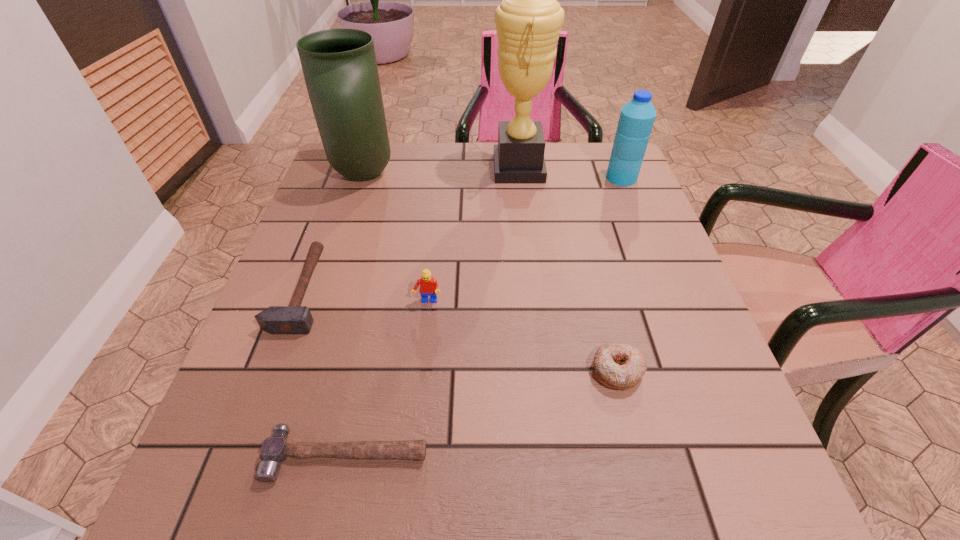
I want to click on the shortest object, so click(275, 449).

In order to click on free space located at the front of the tallest object with handles in this screenshot , I will do `click(412, 168)`.

What are the coordinates of `vacant space situated 0.160m at the front of the tallest object with handles` in the screenshot? It's located at (433, 168).

Where is `vacant space located at the front of the tallest object with handles`? The image size is (960, 540). vacant space located at the front of the tallest object with handles is located at coordinates [x=375, y=168].

In order to click on blank space located 0.400m on the right of the second tallest object in this screenshot , I will do `click(541, 174)`.

Identify the location of vacant space located on the front of the fifth shortest object. (660, 276).

Locate an element on the screen. vacant space located 0.300m on the front-facing side of the fourth shortest object is located at coordinates (410, 460).

Identify the location of vacant region located 0.160m on the striking surface of the taller hammer. The width and height of the screenshot is (960, 540). (403, 291).

You are a GUI agent. You are given a task and a screenshot of the screen. Output one action in this format:
    pyautogui.click(x=<x>, y=<y>)
    Task: Click on the vacant space located on the left of the second nearest object
    The image size is (960, 540).
    Given the screenshot: What is the action you would take?
    pyautogui.click(x=373, y=370)

You are a GUI agent. You are given a task and a screenshot of the screen. Output one action in this format:
    pyautogui.click(x=<x>, y=<y>)
    Task: Click on the trophy cup present at the far edge
    
    Given the screenshot: What is the action you would take?
    pyautogui.click(x=528, y=21)